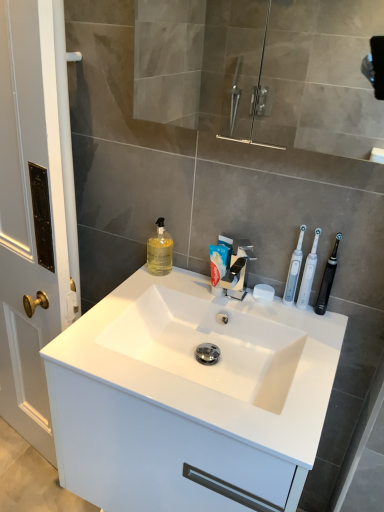
This screenshot has width=384, height=512. Find the location of `free point to the left of white matte toothpaste at center`. free point to the left of white matte toothpaste at center is located at coordinates (158, 288).